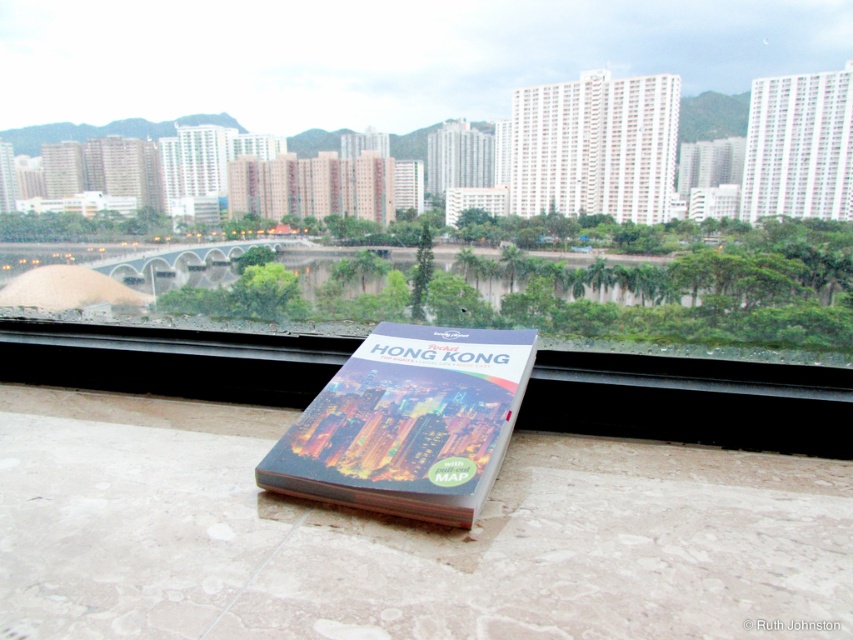
Who is higher up, white tile at lower center or matte plastic hong kong guidebook at center?

white tile at lower center is higher up.

Can you confirm if white tile at lower center is shorter than matte plastic hong kong guidebook at center?

Correct, white tile at lower center is not as tall as matte plastic hong kong guidebook at center.

Between point (76, 355) and point (498, 380), which one is positioned behind?

The point (76, 355) is more distant.

You are a GUI agent. You are given a task and a screenshot of the screen. Output one action in this format:
    pyautogui.click(x=<x>, y=<y>)
    Task: Click on the white tile at lower center
    The width and height of the screenshot is (853, 640).
    Given the screenshot: What is the action you would take?
    pyautogui.click(x=692, y=401)